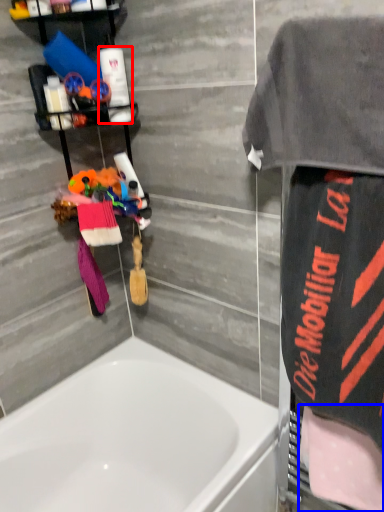
Question: Which of the following is the closest to the observer, toiletry (highlighted by a red box) or beach towel (highlighted by a blue box)?

Choices:
 (A) toiletry
 (B) beach towel

Answer: (B)